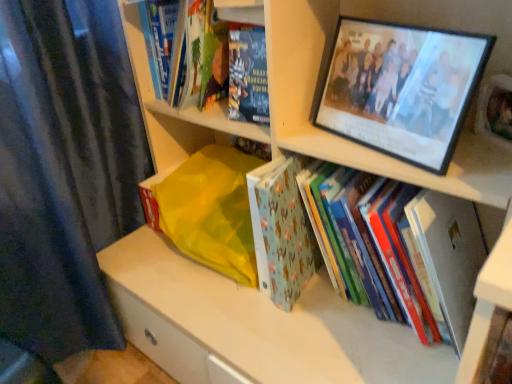
Question: Considering the relative sizes of hardcover book at lower right and hardcover book at center, marked as the 5th book in a left-to-right arrangement, in the image provided, is hardcover book at lower right thinner than hardcover book at center, marked as the 5th book in a left-to-right arrangement,?

Choices:
 (A) yes
 (B) no

Answer: (A)

Question: Is the depth of hardcover book at lower right greater than that of hardcover book at center, marked as the 5th book in a left-to-right arrangement?

Choices:
 (A) no
 (B) yes

Answer: (A)

Question: Does hardcover book at lower right have a greater width compared to hardcover book at center, the 1th book from the right?

Choices:
 (A) yes
 (B) no

Answer: (B)

Question: Would you say hardcover book at center, marked as the 5th book in a left-to-right arrangement, is part of hardcover book at lower right's contents?

Choices:
 (A) yes
 (B) no

Answer: (B)

Question: From a real-world perspective, is hardcover book at lower right physically below hardcover book at center, the 1th book from the right?

Choices:
 (A) no
 (B) yes

Answer: (A)

Question: Does hardcover book at lower right have a lesser height compared to hardcover book at center, marked as the 5th book in a left-to-right arrangement?

Choices:
 (A) no
 (B) yes

Answer: (A)

Question: From a real-world perspective, is hardcover book at upper left, placed as the second book when sorted from left to right, on hardcover book at upper left, which ranks as the first book in left-to-right order?

Choices:
 (A) yes
 (B) no

Answer: (A)

Question: From a real-world perspective, is hardcover book at upper left, the fourth book viewed from the right, under hardcover book at upper left, positioned as the fifth book in right-to-left order?

Choices:
 (A) yes
 (B) no

Answer: (B)

Question: Is the position of hardcover book at upper left, the fourth book viewed from the right, more distant than that of hardcover book at upper left, which ranks as the first book in left-to-right order?

Choices:
 (A) no
 (B) yes

Answer: (A)

Question: Does hardcover book at upper left, the fourth book viewed from the right, have a lesser width compared to hardcover book at upper left, which ranks as the first book in left-to-right order?

Choices:
 (A) no
 (B) yes

Answer: (A)

Question: Is hardcover book at upper left, placed as the second book when sorted from left to right, located outside hardcover book at upper left, which ranks as the first book in left-to-right order?

Choices:
 (A) yes
 (B) no

Answer: (A)

Question: Is hardcover book at upper left, the fourth book viewed from the right, to the left of hardcover book at upper left, which ranks as the first book in left-to-right order, from the viewer's perspective?

Choices:
 (A) no
 (B) yes

Answer: (A)

Question: Could you tell me if hardcover book at upper left, positioned as the fifth book in right-to-left order, is turned towards light blue fabric book at center, acting as the fourth book starting from the left?

Choices:
 (A) no
 (B) yes

Answer: (A)